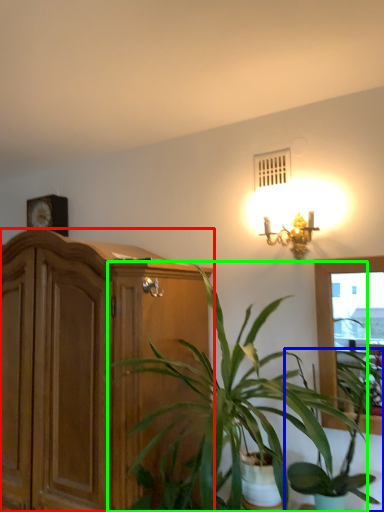
Question: Based on their relative distances, which object is farther from cabinetry (highlighted by a red box)? Choose from houseplant (highlighted by a blue box) and houseplant (highlighted by a green box).

Choices:
 (A) houseplant
 (B) houseplant

Answer: (A)